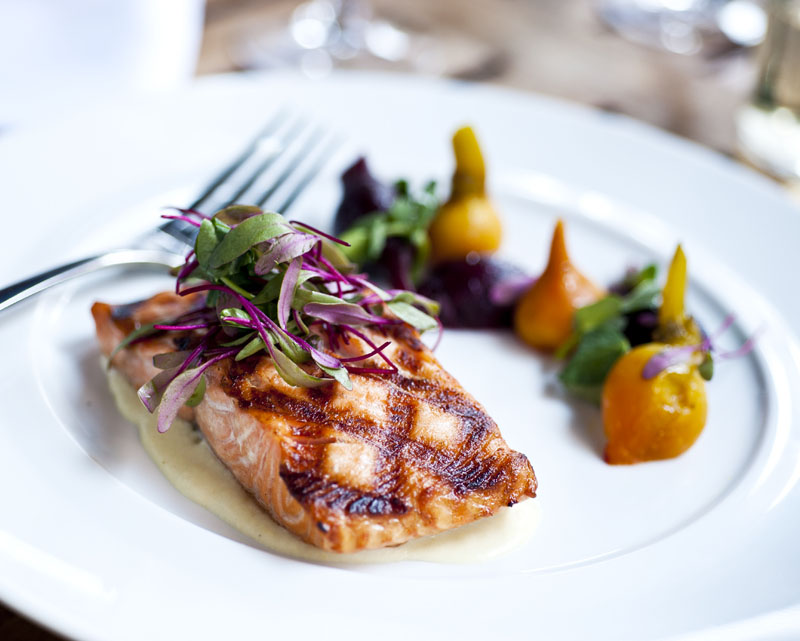
I want to click on dish, so click(x=128, y=21).